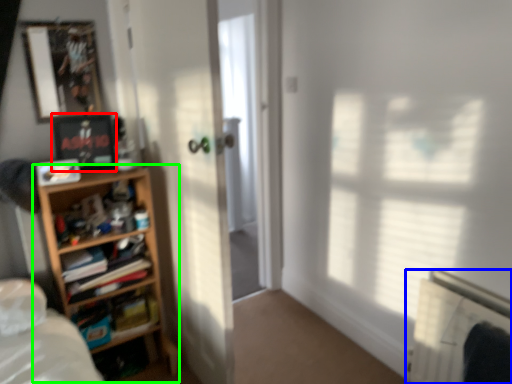
Question: Which object is the closest to the picture frame (highlighted by a red box)? Choose among these: radiator (highlighted by a blue box) or shelf (highlighted by a green box).

Choices:
 (A) radiator
 (B) shelf

Answer: (B)